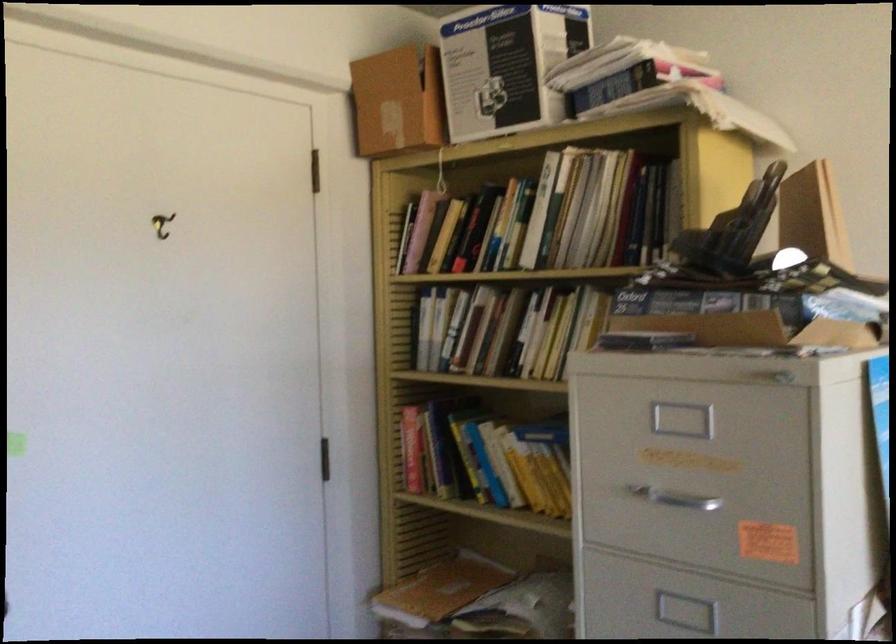
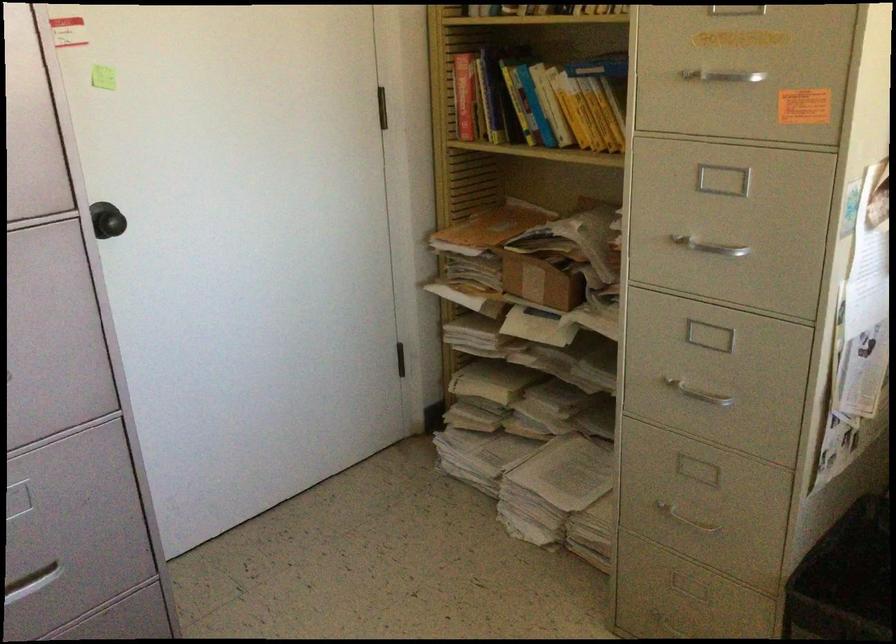
Locate, in the second image, the point that corresponds to (472,471) in the first image.

(523, 111)